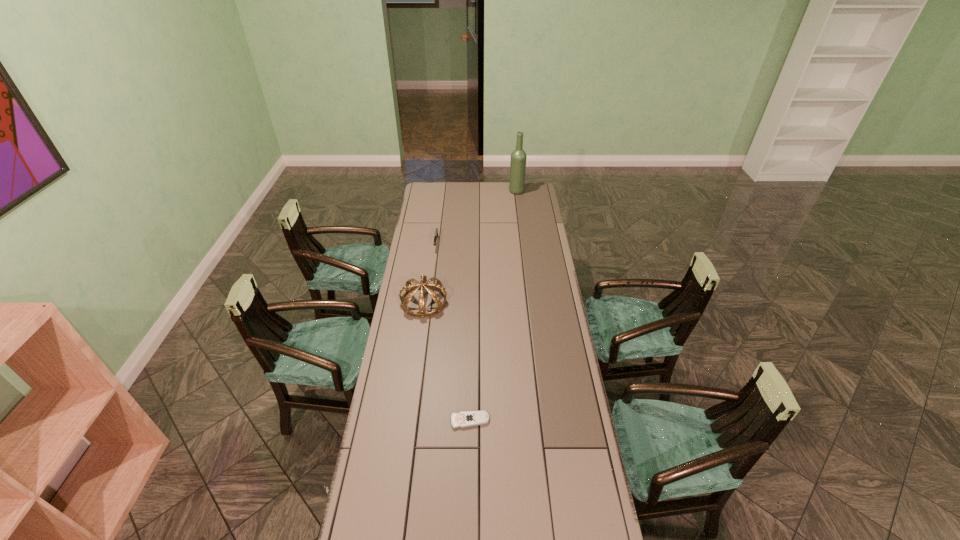
Where is `free space located 0.310m at the muzzle end of the gun`? The height and width of the screenshot is (540, 960). free space located 0.310m at the muzzle end of the gun is located at coordinates (430, 292).

Image resolution: width=960 pixels, height=540 pixels. I want to click on blank area located 0.070m on the back of the second object from right to left, so click(x=470, y=396).

Locate an element on the screen. The image size is (960, 540). object that is at the far edge is located at coordinates (518, 157).

Identify the location of tiara that is positioned at the left edge. The width and height of the screenshot is (960, 540). (410, 289).

Where is `gun present at the left edge`? gun present at the left edge is located at coordinates (436, 230).

The image size is (960, 540). I want to click on object present at the right edge, so click(518, 157).

Image resolution: width=960 pixels, height=540 pixels. I want to click on object that is at the far right corner, so click(x=518, y=157).

In the image, there is a desktop. At what (x,y) coordinates should I click in order to perform the action: click on vacant space at the far edge. Please return your answer as a coordinate pair (x, y). Image resolution: width=960 pixels, height=540 pixels. Looking at the image, I should click on (502, 187).

Identify the location of vacant space at the left edge of the desktop. (403, 389).

In the image, there is a desktop. Where is `vacant space at the right edge`? This screenshot has height=540, width=960. vacant space at the right edge is located at coordinates (538, 229).